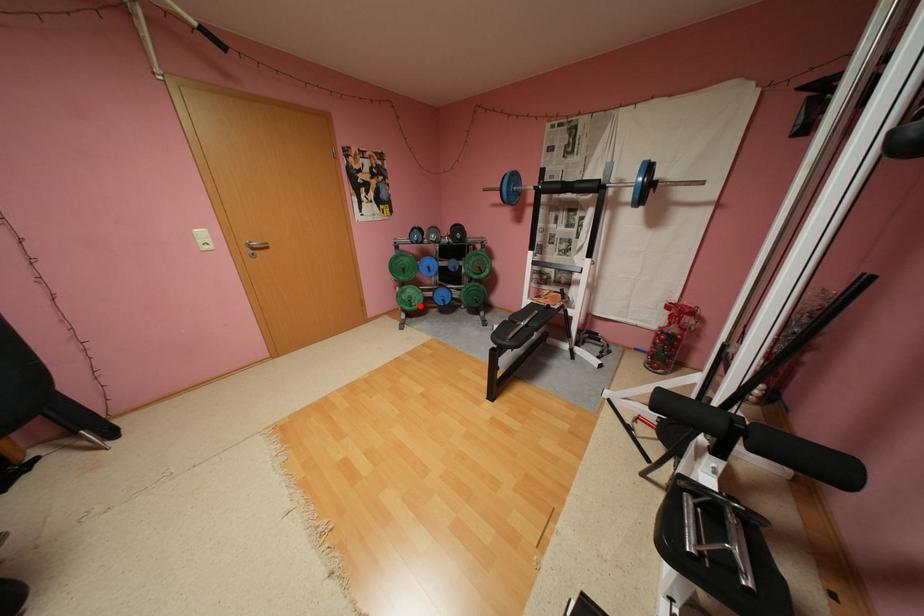
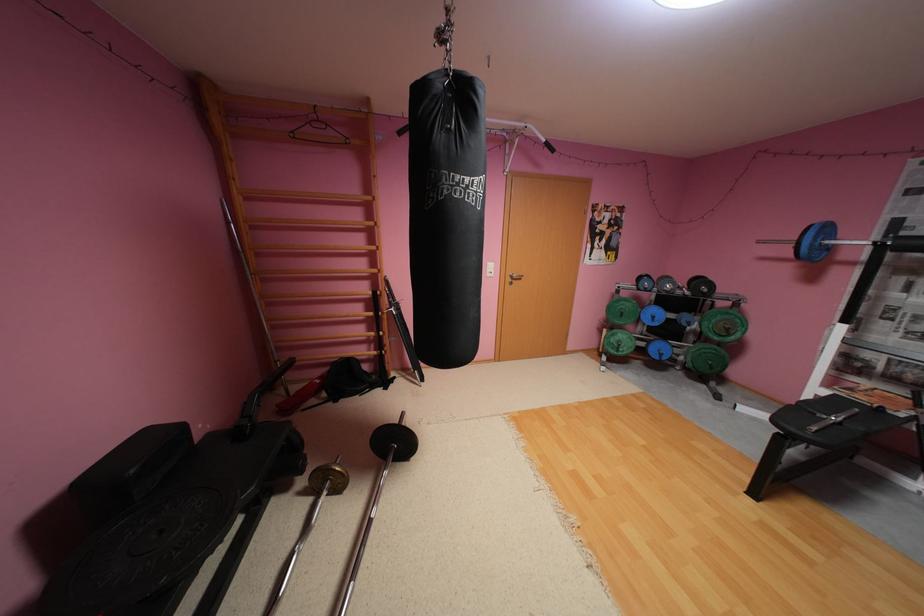
Question: I am providing you with two images of the same scene from different viewpoints. Image1 has a red point marked. In image2, the corresponding 3D location appears at what relative position? Reply with the corresponding letter.

Choices:
 (A) Closer
 (B) Farther

Answer: (B)